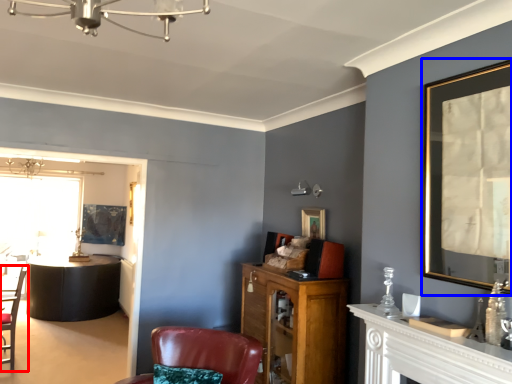
Question: Which object appears farthest to the camera in this image, chair (highlighted by a red box) or picture frame (highlighted by a blue box)?

Choices:
 (A) chair
 (B) picture frame

Answer: (A)